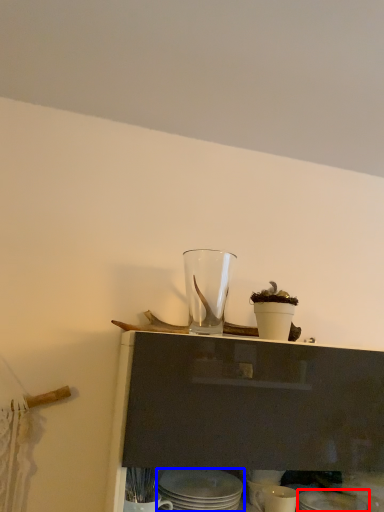
Question: Which object appears closest to the camera in this image, tableware (highlighted by a red box) or tableware (highlighted by a blue box)?

Choices:
 (A) tableware
 (B) tableware

Answer: (B)